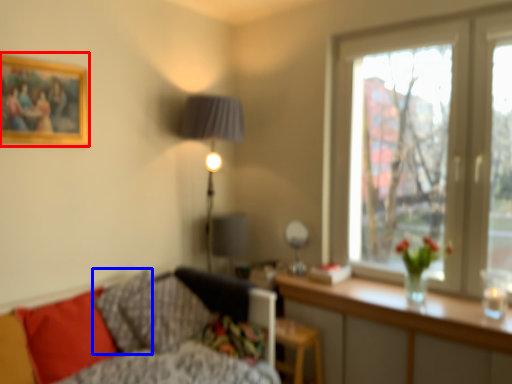
Question: Which object appears closest to the camera in this image, picture frame (highlighted by a red box) or pillow (highlighted by a blue box)?

Choices:
 (A) picture frame
 (B) pillow

Answer: (A)